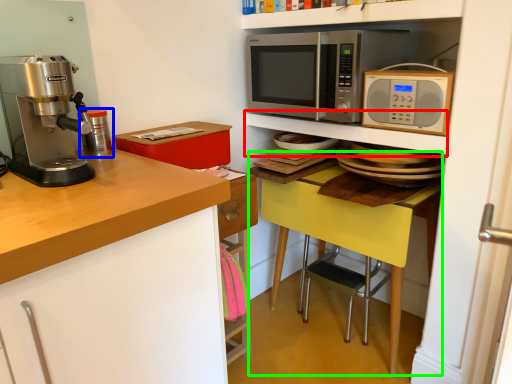
Question: Which object is positioned closest to shelf (highlighted by a red box)? Select from appliance (highlighted by a blue box) and table (highlighted by a green box).

Choices:
 (A) appliance
 (B) table

Answer: (B)